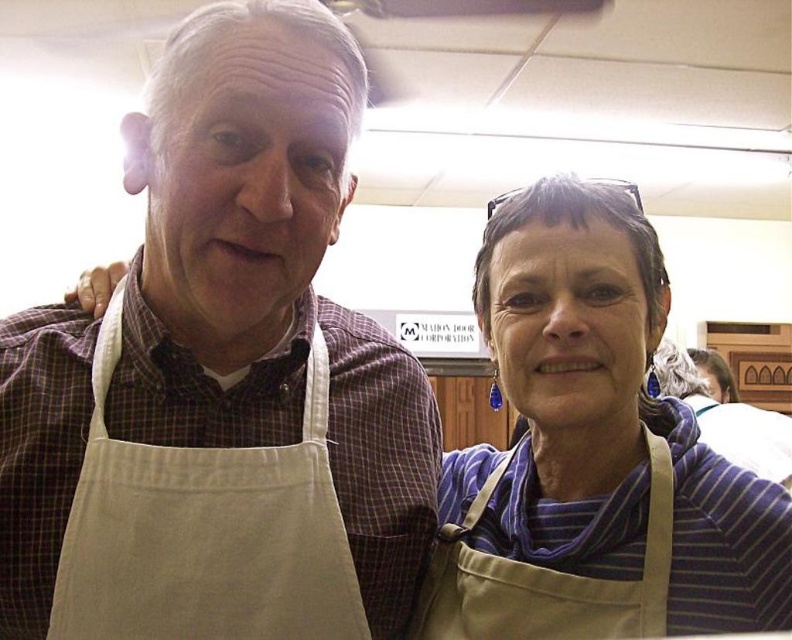
Question: Estimate the real-world distances between objects in this image. Which object is closer to the matte beige apron at center?

Choices:
 (A) beige cotton apron at center
 (B) tan canvas apron at center
 (C) beige cotton apron at left

Answer: (B)

Question: Which object is closer to the camera taking this photo?

Choices:
 (A) beige cotton apron at center
 (B) tan canvas apron at center

Answer: (A)

Question: Can you confirm if beige cotton apron at center is thinner than tan canvas apron at center?

Choices:
 (A) yes
 (B) no

Answer: (B)

Question: Is beige cotton apron at left positioned in front of tan canvas apron at center?

Choices:
 (A) no
 (B) yes

Answer: (B)

Question: Does beige cotton apron at center have a greater width compared to beige cotton apron at left?

Choices:
 (A) yes
 (B) no

Answer: (A)

Question: Based on their relative distances, which object is farther from the matte beige apron at center?

Choices:
 (A) beige cotton apron at left
 (B) beige cotton apron at center

Answer: (A)